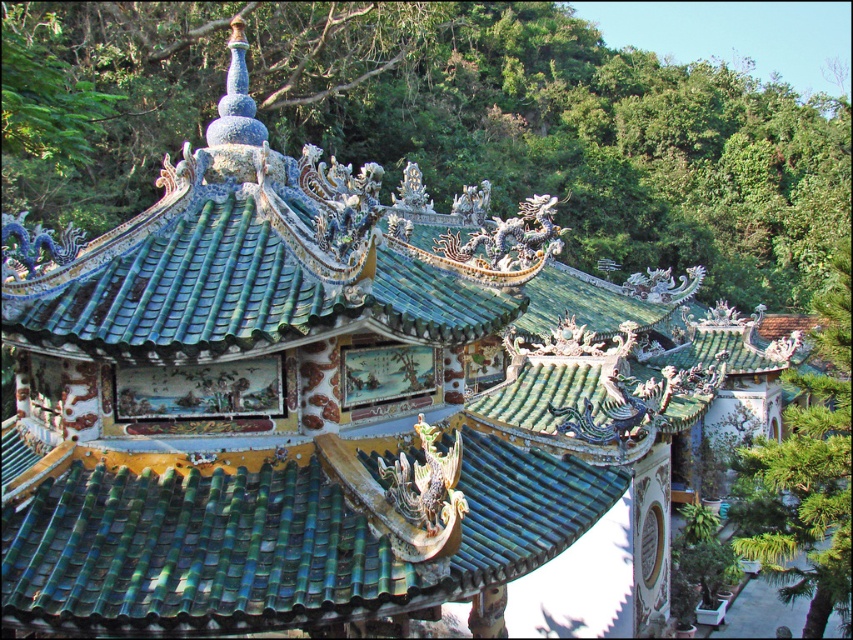
Question: Which of the following is the farthest from the observer?

Choices:
 (A) green leafy tree at right
 (B) green glazed tiles at center

Answer: (A)

Question: Can you confirm if green glazed tiles at center is wider than green leafy tree at right?

Choices:
 (A) yes
 (B) no

Answer: (B)

Question: Does green glazed tiles at center have a lesser width compared to green leafy tree at right?

Choices:
 (A) yes
 (B) no

Answer: (A)

Question: Does green leafy tree at upper center come behind green glazed tiles at center?

Choices:
 (A) yes
 (B) no

Answer: (A)

Question: Among these objects, which one is nearest to the camera?

Choices:
 (A) green glazed tiles at center
 (B) green leafy tree at upper center
 (C) green leafy tree at right

Answer: (A)

Question: Which is nearer to the green leafy tree at right?

Choices:
 (A) green leafy tree at upper center
 (B) green glazed tiles at center

Answer: (A)